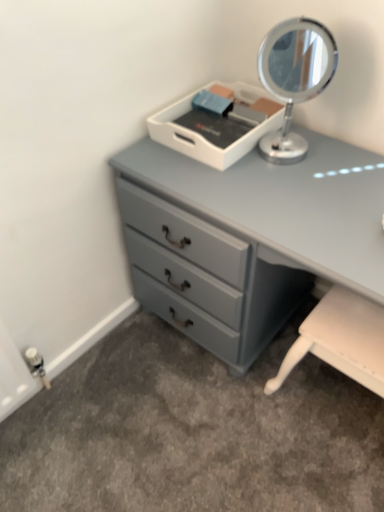
Question: Is the depth of silver metallic mirror at upper right less than that of matte gray dresser at center?

Choices:
 (A) no
 (B) yes

Answer: (A)

Question: Is silver metallic mirror at upper right facing away from matte gray dresser at center?

Choices:
 (A) yes
 (B) no

Answer: (B)

Question: Is matte gray dresser at center surrounded by silver metallic mirror at upper right?

Choices:
 (A) yes
 (B) no

Answer: (B)

Question: Considering the relative sizes of silver metallic mirror at upper right and matte gray dresser at center in the image provided, is silver metallic mirror at upper right shorter than matte gray dresser at center?

Choices:
 (A) yes
 (B) no

Answer: (A)

Question: Is silver metallic mirror at upper right further to the viewer compared to matte gray dresser at center?

Choices:
 (A) no
 (B) yes

Answer: (B)

Question: From the image's perspective, is silver metallic mirror at upper right on top of matte gray dresser at center?

Choices:
 (A) no
 (B) yes

Answer: (B)

Question: Considering the relative sizes of matte gray dresser at center and silver metallic mirror at upper right in the image provided, is matte gray dresser at center smaller than silver metallic mirror at upper right?

Choices:
 (A) yes
 (B) no

Answer: (B)

Question: Is matte gray dresser at center positioned in front of silver metallic mirror at upper right?

Choices:
 (A) no
 (B) yes

Answer: (B)

Question: From a real-world perspective, is matte gray dresser at center under silver metallic mirror at upper right?

Choices:
 (A) yes
 (B) no

Answer: (A)

Question: Is matte gray dresser at center not inside silver metallic mirror at upper right?

Choices:
 (A) no
 (B) yes

Answer: (B)

Question: Is matte gray dresser at center bigger than silver metallic mirror at upper right?

Choices:
 (A) no
 (B) yes

Answer: (B)

Question: Does matte gray dresser at center turn towards silver metallic mirror at upper right?

Choices:
 (A) no
 (B) yes

Answer: (A)

Question: From a real-world perspective, is matte gray dresser at center physically located above or below silver metallic mirror at upper right?

Choices:
 (A) below
 (B) above

Answer: (A)